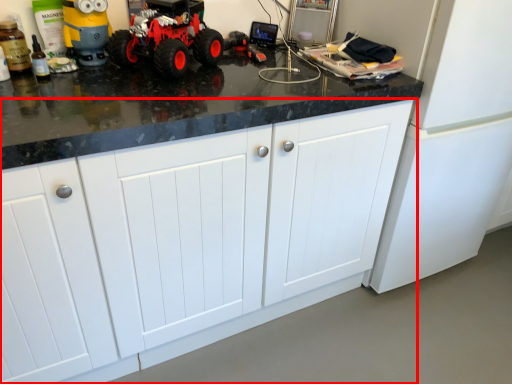
Question: From the image's perspective, what is the correct spatial positioning of cabinetry (annotated by the red box) in reference to land vehicle?

Choices:
 (A) above
 (B) below

Answer: (B)